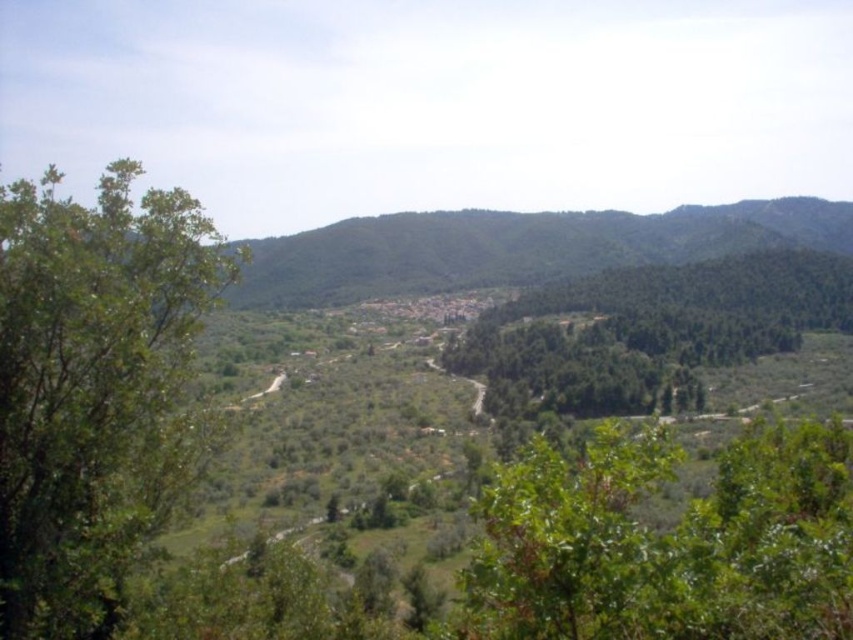
You are an environmental scientist analyzing the landscape. You observe the green leafy tree at left and the green leafy tree at center. Which tree would you estimate has a smaller canopy area based on their visual representation in the image?

The green leafy tree at left has a smaller canopy area than the green leafy tree at center because it occupies less space in the image.

In the scene shown: You are standing at the point with coordinates point [756,595] and want to look towards the point with coordinates point [94,234]. Which direction should you face?

You should face north because point [94,234] is behind point [756,595], indicating it is in the northern direction.

You are standing at the top of a hill overlooking the landscape. You notice a green leafy tree at center and green leafy trees at center. Which one is closer to the bottom of the image?

The green leafy tree at center is closer to the bottom of the image because it is positioned below the green leafy trees at center.